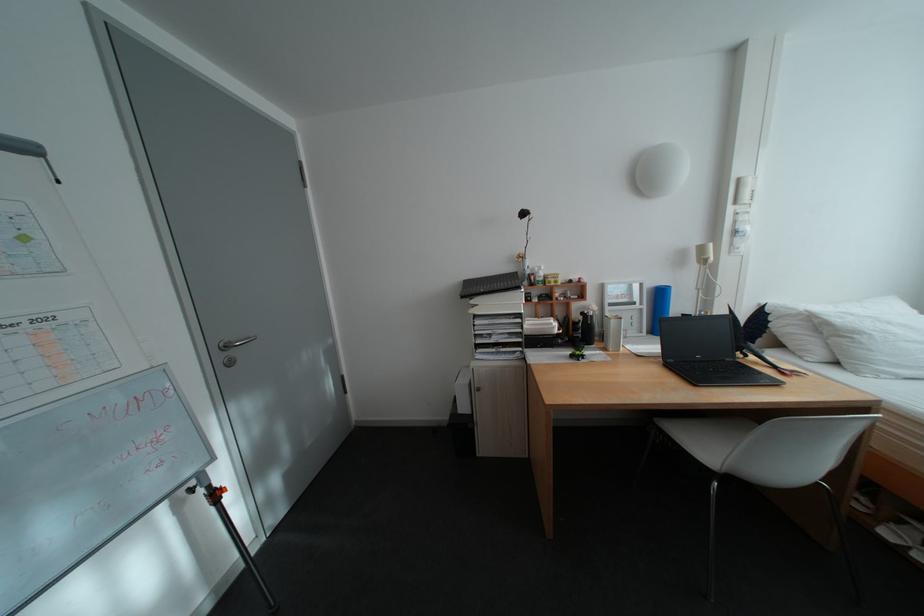
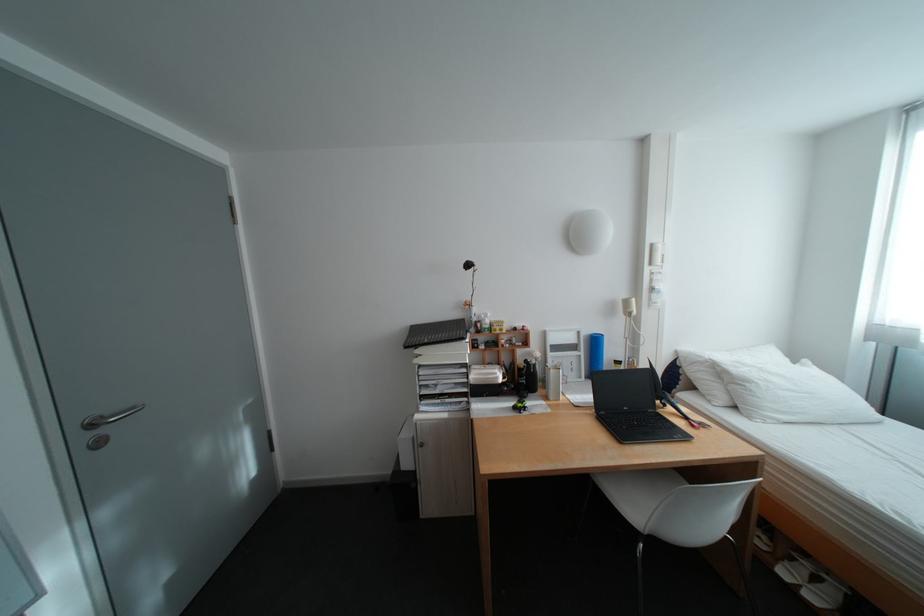
Where in the second image is the point corresponding to [609,310] from the first image?

(552, 358)